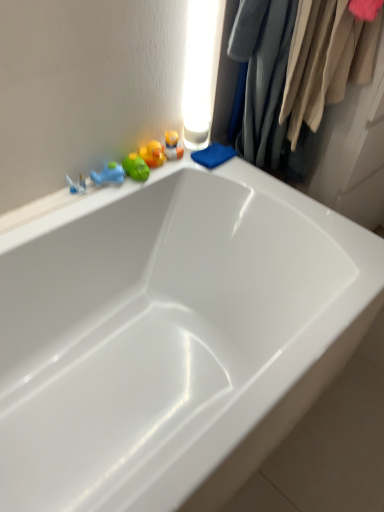
Question: Is translucent plastic toys at upper left, the 1th toy viewed from the right, outside velvet fabric clothes at upper right?

Choices:
 (A) yes
 (B) no

Answer: (A)

Question: From a real-world perspective, is translucent plastic toys at upper left, the 1th toy viewed from the right, physically above velvet fabric clothes at upper right?

Choices:
 (A) no
 (B) yes

Answer: (A)

Question: Does translucent plastic toys at upper left, the 1th toy viewed from the right, lie in front of velvet fabric clothes at upper right?

Choices:
 (A) no
 (B) yes

Answer: (A)

Question: Is translucent plastic toys at upper left, acting as the 3th toy starting from the left, to the left of velvet fabric clothes at upper right from the viewer's perspective?

Choices:
 (A) yes
 (B) no

Answer: (A)

Question: Is translucent plastic toys at upper left, acting as the 3th toy starting from the left, positioned far away from velvet fabric clothes at upper right?

Choices:
 (A) yes
 (B) no

Answer: (B)

Question: From the image's perspective, is translucent plastic toys at upper left, acting as the 3th toy starting from the left, on top of velvet fabric clothes at upper right?

Choices:
 (A) yes
 (B) no

Answer: (B)

Question: From the image's perspective, is rubber duck at upper left, the second toy viewed from the right, under green rubber duck at upper left, which is the first toy from left to right?

Choices:
 (A) yes
 (B) no

Answer: (B)

Question: Considering the relative sizes of rubber duck at upper left, the second toy viewed from the right, and green rubber duck at upper left, the third toy positioned from the right, in the image provided, is rubber duck at upper left, the second toy viewed from the right, shorter than green rubber duck at upper left, the third toy positioned from the right,?

Choices:
 (A) yes
 (B) no

Answer: (B)

Question: Is rubber duck at upper left, which is the second toy from left to right, not near green rubber duck at upper left, the third toy positioned from the right?

Choices:
 (A) no
 (B) yes

Answer: (A)

Question: Is rubber duck at upper left, which is the second toy from left to right, to the right of green rubber duck at upper left, the third toy positioned from the right, from the viewer's perspective?

Choices:
 (A) no
 (B) yes

Answer: (B)

Question: Is rubber duck at upper left, the second toy viewed from the right, looking in the opposite direction of green rubber duck at upper left, the third toy positioned from the right?

Choices:
 (A) no
 (B) yes

Answer: (A)

Question: From the image's perspective, would you say rubber duck at upper left, which is the second toy from left to right, is positioned over green rubber duck at upper left, which is the first toy from left to right?

Choices:
 (A) no
 (B) yes

Answer: (B)

Question: Is rubber duck at upper left, which is the second toy from left to right, inside translucent plastic toys at upper left, acting as the 3th toy starting from the left?

Choices:
 (A) yes
 (B) no

Answer: (B)